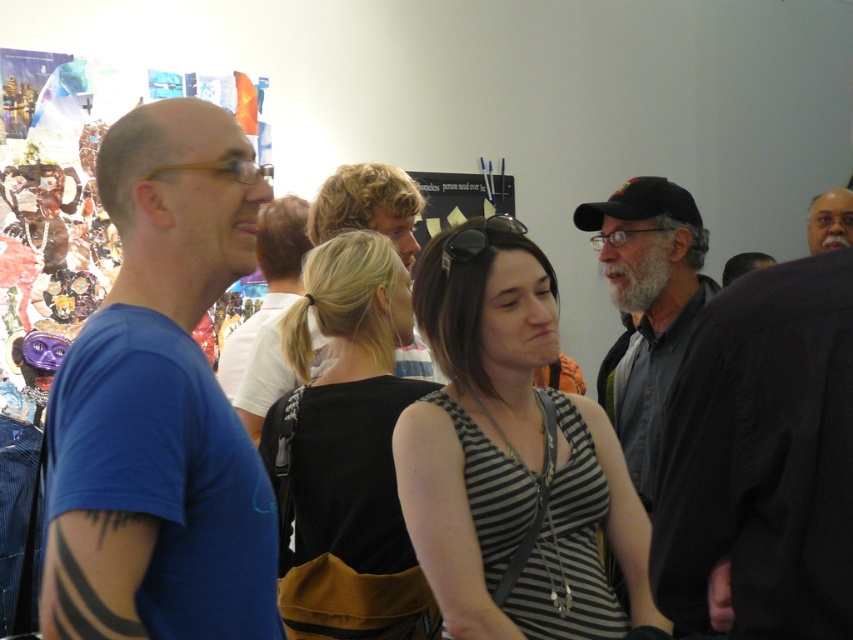
Based on the photo, is blue cotton t-shirt at left to the left of black fabric at center from the viewer's perspective?

Correct, you'll find blue cotton t-shirt at left to the left of black fabric at center.

In the scene shown: Does blue cotton t-shirt at left have a lesser height compared to black fabric at center?

Correct, blue cotton t-shirt at left is not as tall as black fabric at center.

Describe the element at coordinates (160, 403) in the screenshot. The height and width of the screenshot is (640, 853). I see `blue cotton t-shirt at left` at that location.

The image size is (853, 640). Find the location of `blue cotton t-shirt at left`. blue cotton t-shirt at left is located at coordinates (160, 403).

Between gray fabric shirt at center and gray hair at upper right, which one is positioned higher?

gray hair at upper right is higher up.

Can you confirm if gray fabric shirt at center is positioned to the left of gray hair at upper right?

Indeed, gray fabric shirt at center is positioned on the left side of gray hair at upper right.

Locate an element on the screen. The width and height of the screenshot is (853, 640). gray fabric shirt at center is located at coordinates (648, 304).

What do you see at coordinates (511, 458) in the screenshot? I see `striped fabric tank top at center` at bounding box center [511, 458].

Which is in front, point (422, 332) or point (840, 212)?

Positioned in front is point (422, 332).

What are the coordinates of `striped fabric tank top at center` in the screenshot? It's located at (511, 458).